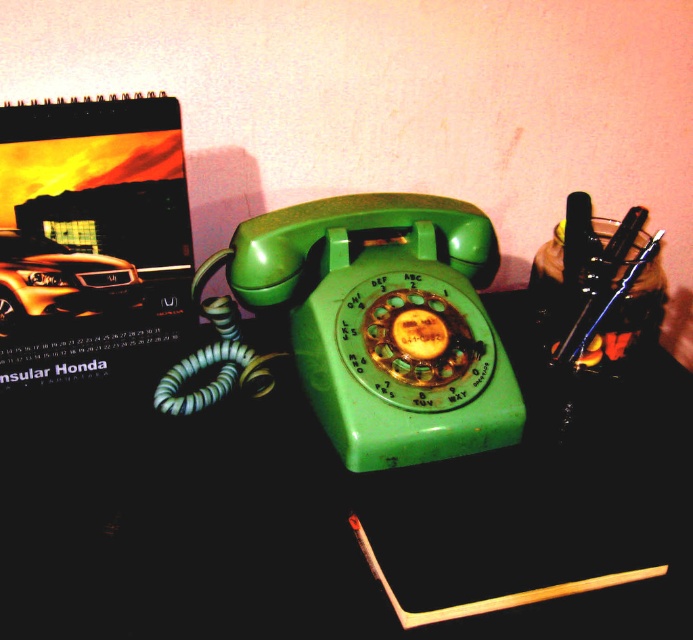
You are standing in front of the vintage green rotary telephone placed on a dark surface against a light pink wall. You see a point marked at coordinates (x=319, y=500). Which object does this point correspond to?

The point at coordinates (x=319, y=500) corresponds to the green plastic telephone at center.

You are standing in front of the vintage green rotary telephone. Where exactly is the green plastic telephone at center located in terms of coordinates?

The green plastic telephone at center is located at point coordinates (319,500).

You are organizing a desk and need to place the green plastic rotary phone at center and the matte paper notebook at upper left. According to the image, which object is located higher up?

The matte paper notebook at upper left is located higher up than the green plastic rotary phone at center.